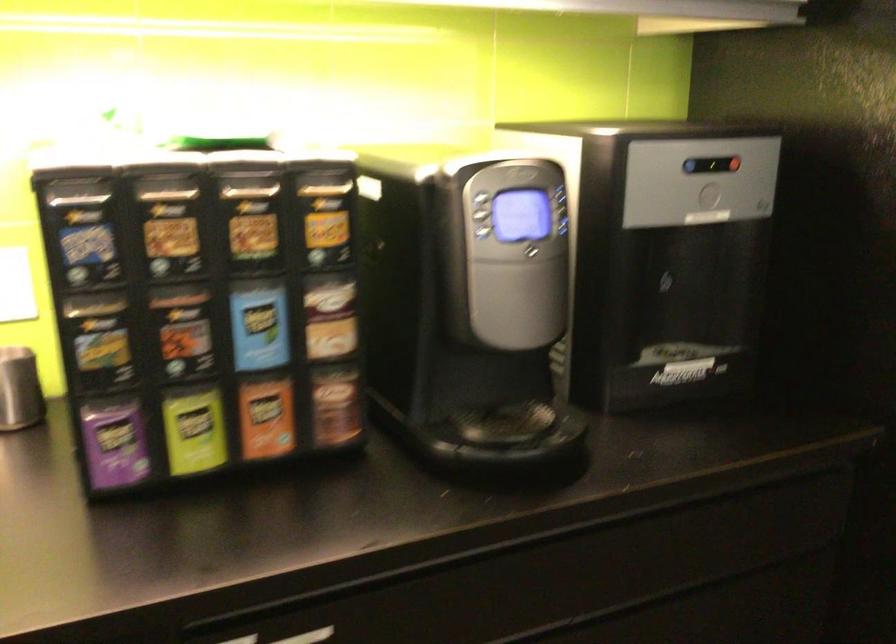
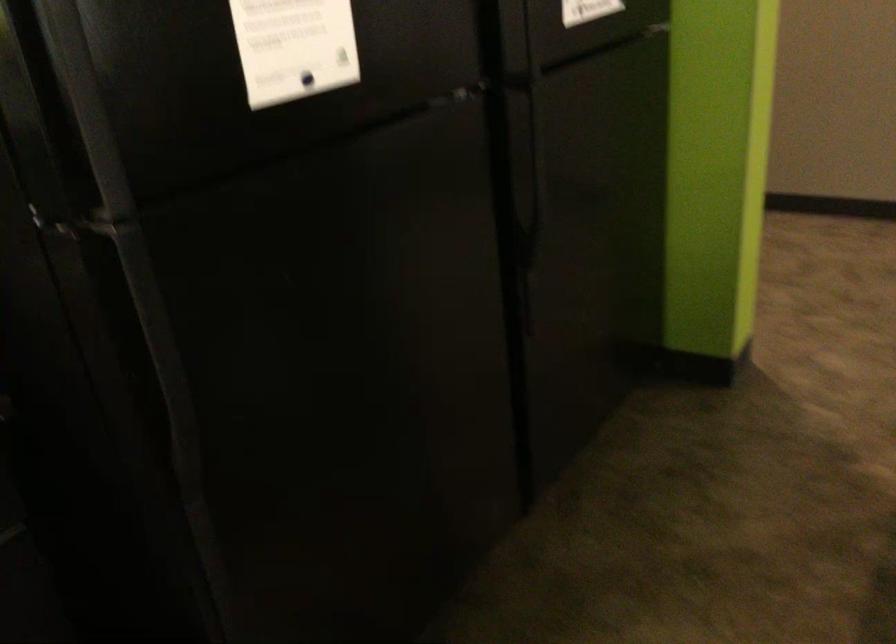
Question: The camera is either moving clockwise (left) or counter-clockwise (right) around the object. The first image is from the beginning of the video and the second image is from the end. Is the camera moving left or right when shooting the video?

Choices:
 (A) Left
 (B) Right

Answer: (A)